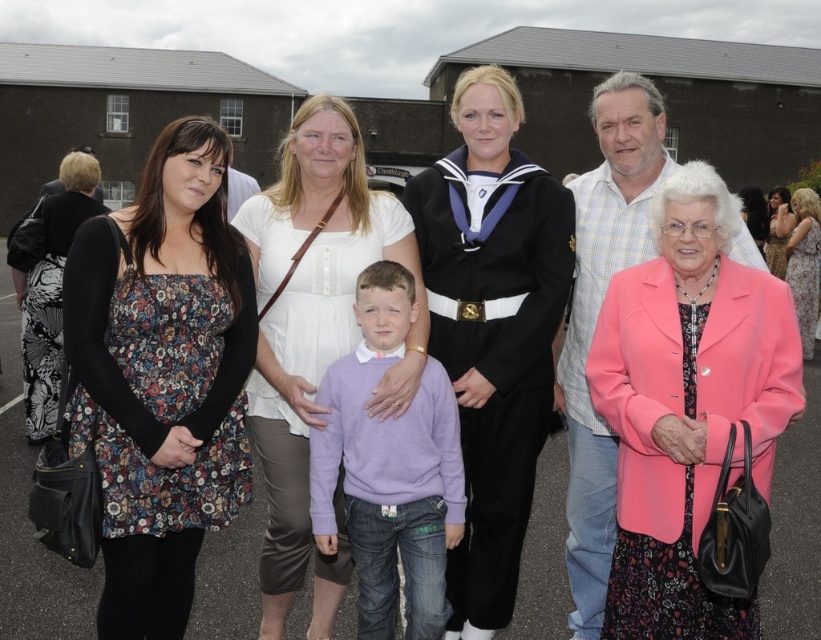
You are standing at the origin of the coordinate system in the image. You want to walk to point A at point (28, 380) and point B at point (755, 205). Which point will you reach first if you walk straight ahead?

Point A at point (28, 380) will be reached first because it is in front of point B at point (755, 205) from your current position.